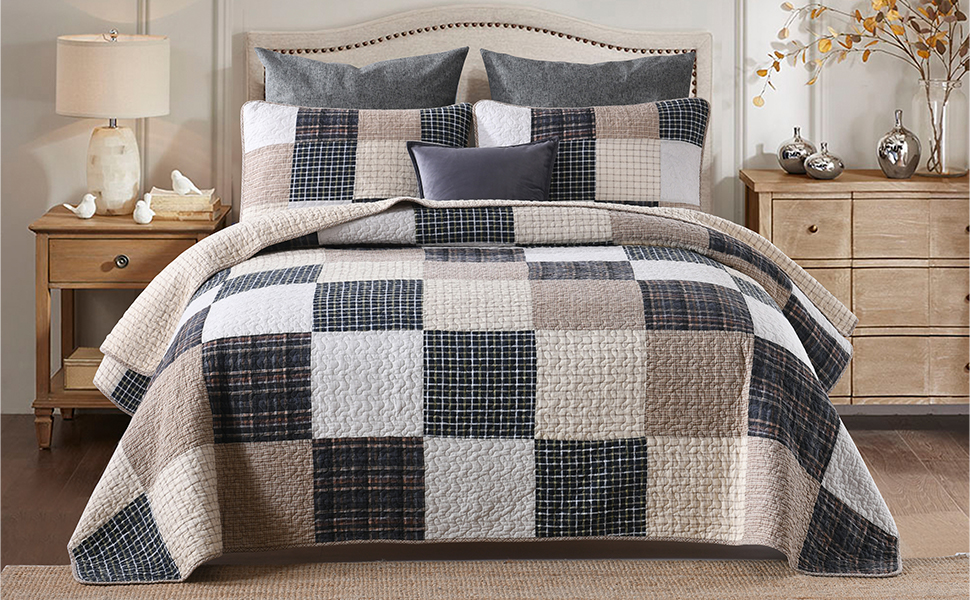
Where is `bedspread`? bedspread is located at coordinates (710, 402).